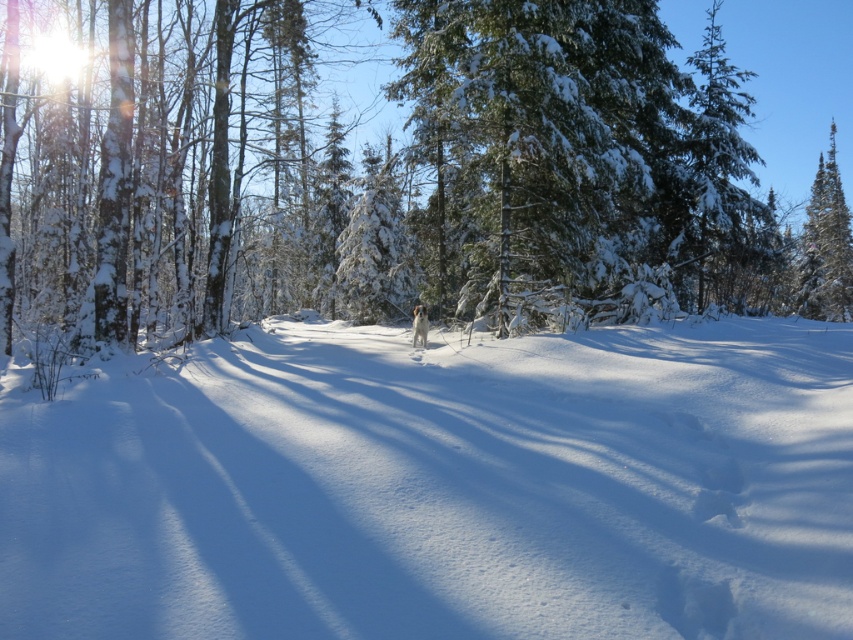
Which is behind, point (550, 627) or point (712, 269)?

The point (712, 269) is more distant.

This screenshot has width=853, height=640. What do you see at coordinates (438, 486) in the screenshot? I see `white fluffy snow at center` at bounding box center [438, 486].

Does point (201, 429) come in front of point (223, 244)?

Yes, it is in front of point (223, 244).

The width and height of the screenshot is (853, 640). Identify the location of white fluffy snow at center. (438, 486).

Between white fluffy snow at center and white fluffy dog at center, which one appears on the left side from the viewer's perspective?

white fluffy dog at center is more to the left.

Does point (45, 579) come behind point (415, 346)?

That is False.

The height and width of the screenshot is (640, 853). I want to click on white fluffy snow at center, so click(438, 486).

Image resolution: width=853 pixels, height=640 pixels. What do you see at coordinates (389, 173) in the screenshot?
I see `snow-covered evergreen tree at center` at bounding box center [389, 173].

Based on the photo, which is more to the left, snow-covered evergreen tree at center or white fluffy dog at center?

white fluffy dog at center is more to the left.

Where is `snow-covered evergreen tree at center`? This screenshot has width=853, height=640. snow-covered evergreen tree at center is located at coordinates (389, 173).